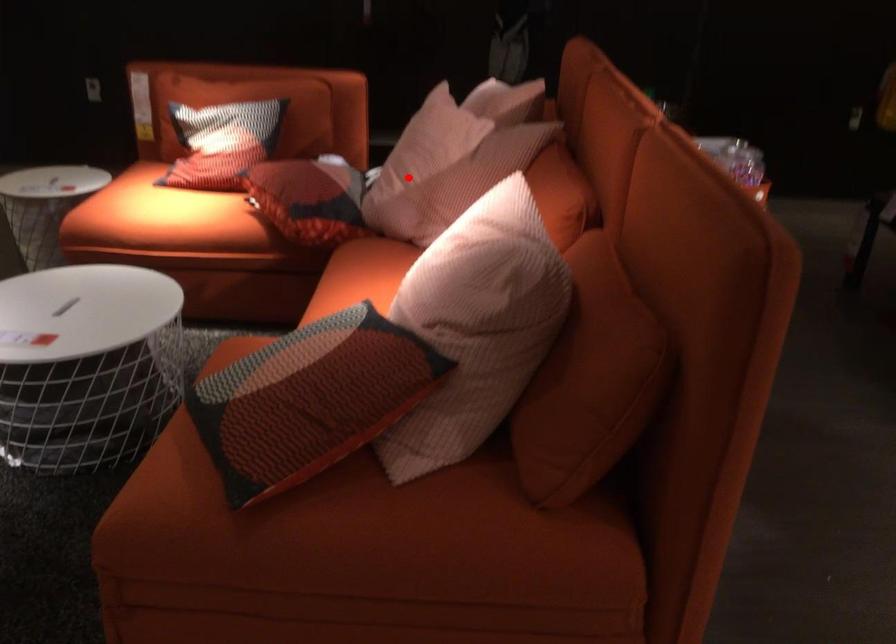
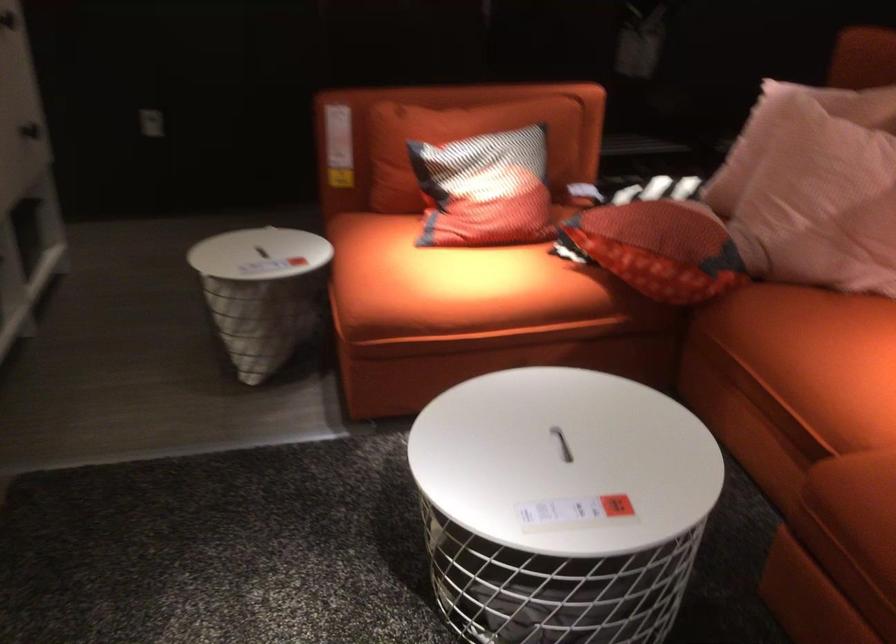
Question: I am providing you with two images of the same scene from different viewpoints. In image1, a red point is highlighted. Considering the same 3D point in image2, which of the following is correct?

Choices:
 (A) It is closer
 (B) It is farther

Answer: (A)